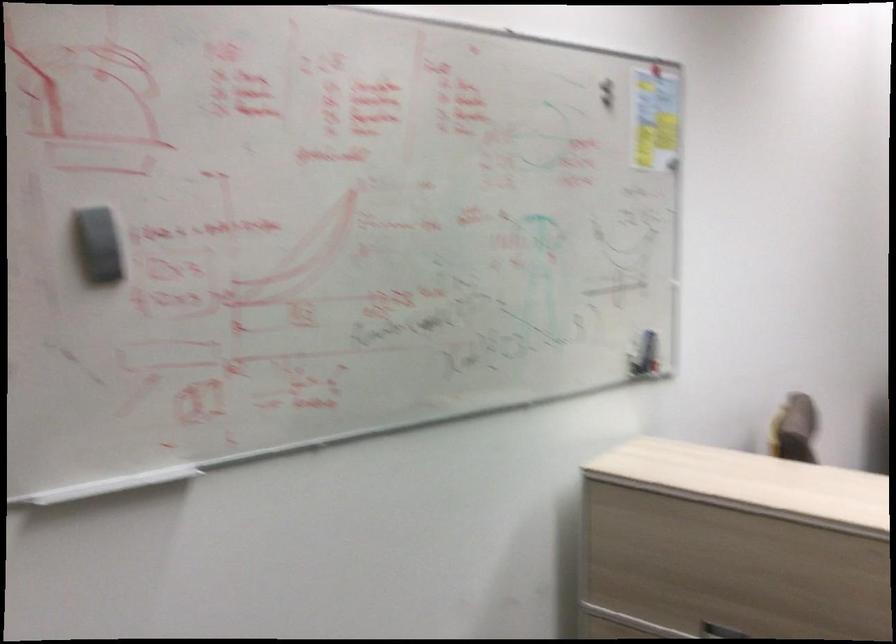
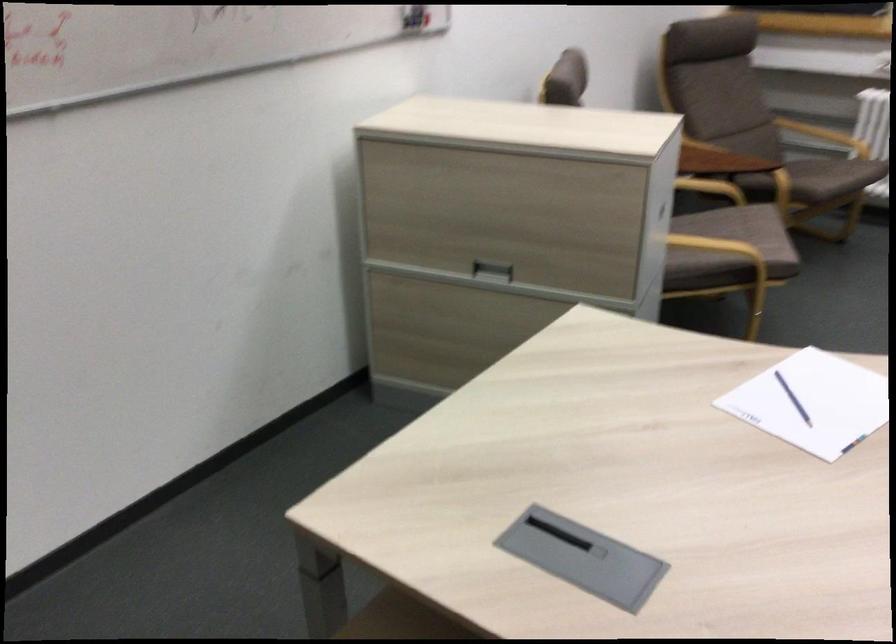
The images are taken continuously from a first-person perspective. In which direction are you moving?

The cameraman walked toward right, backward.